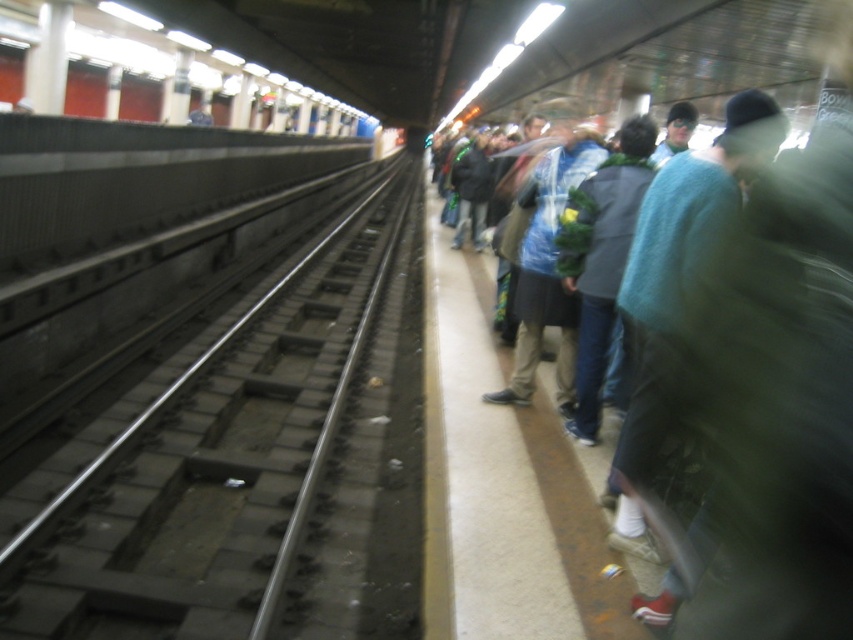
You are waiting for the train at the subway station. You see the concrete track at left and the metallic gray train at upper left. Which object is closer to your right side?

The concrete track at left is to the right of metallic gray train at upper left, so the concrete track at left is closer to your right side.

You are a commuter waiting on the platform and need to board the metallic gray train at upper left. The concrete track at left is in your path. Considering their sizes, which object might you need to avoid stepping onto to reach the train?

The concrete track at left is smaller than the metallic gray train at upper left, so you should avoid stepping onto the concrete track at left to reach the train.